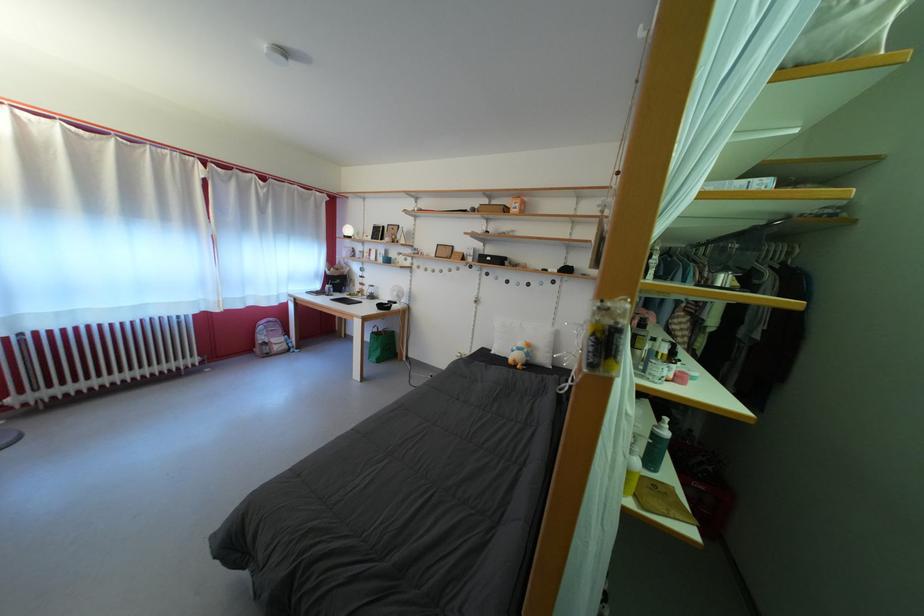
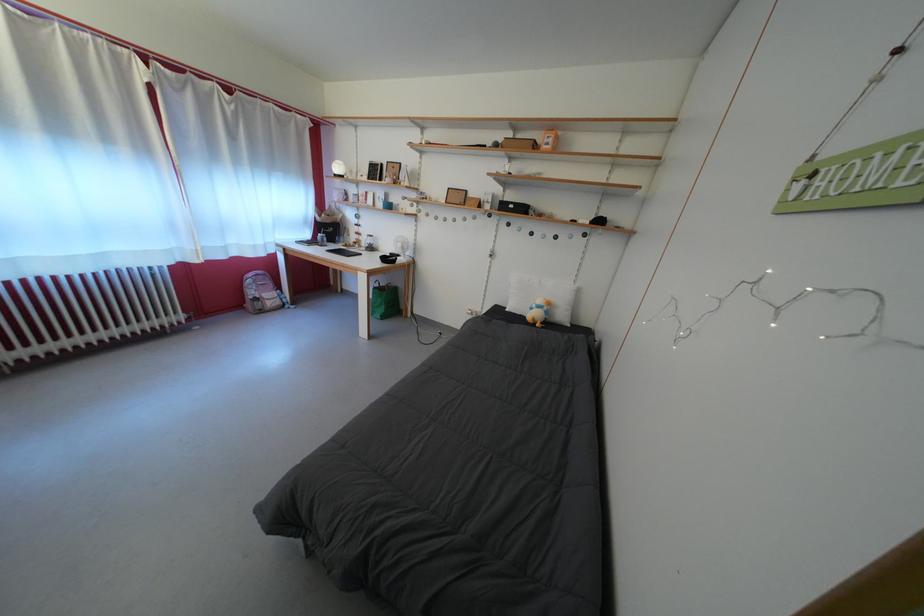
In the second image, find the point that corresponds to point 503,208 in the first image.

(527, 142)